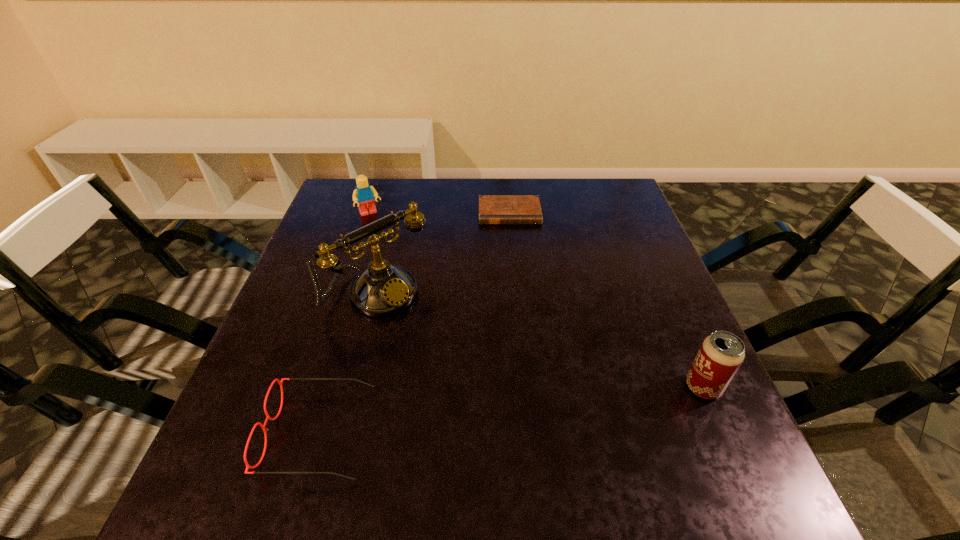
Locate an element on the screen. free point located on the dial of the telephone is located at coordinates (453, 357).

Find the location of a particular element. vacant point located on the dial of the telephone is located at coordinates (531, 428).

I want to click on free space located 0.280m on the spine side of the second object from right to left, so click(516, 295).

At what (x,y) coordinates should I click in order to perform the action: click on vacant position located on the spine side of the second object from right to left. Please return your answer as a coordinate pair (x, y). This screenshot has height=540, width=960. Looking at the image, I should click on (514, 254).

Identify the location of vacant space located 0.130m on the spine side of the second object from right to left. (514, 254).

You are a GUI agent. You are given a task and a screenshot of the screen. Output one action in this format:
    pyautogui.click(x=<x>, y=<y>)
    Task: Click on the free location located on the front-facing side of the Lego
    
    Given the screenshot: What is the action you would take?
    pyautogui.click(x=401, y=267)

I want to click on free space located 0.140m on the front-facing side of the Lego, so click(390, 247).

Where is `vacant point located 0.290m on the front-facing side of the Lego`? vacant point located 0.290m on the front-facing side of the Lego is located at coordinates (409, 281).

Locate an element on the screen. The height and width of the screenshot is (540, 960). diary located in the far edge section of the desktop is located at coordinates (493, 209).

I want to click on Lego that is at the far edge, so click(363, 195).